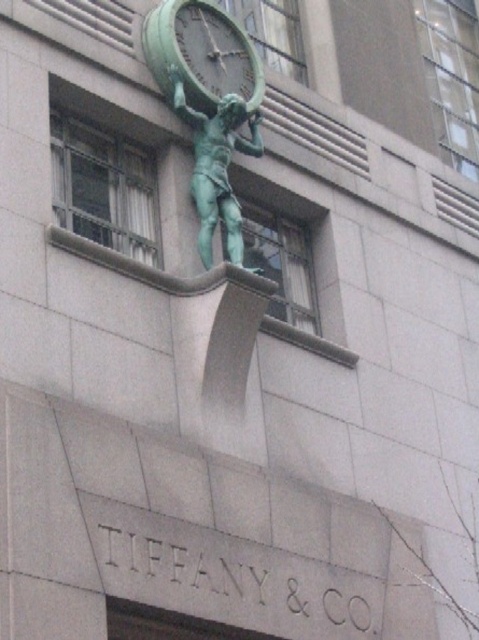
You are standing in front of the building and looking at the statue. There are two points marked on the statue. The first point is at coordinates point (x=216, y=36) and the second point is at point (x=234, y=108). Which point appears closer to your eyes?

Point (x=216, y=36) is further to the camera than point (x=234, y=108). Therefore, point (x=234, y=108) appears closer to your eyes.

You are an architect assessing the building facade. You need to determine which object, the green patina clock at upper center or the green patina statue at center, has a larger physical size based on their positions. Which one is bigger?

The green patina clock at upper center is bigger than the green patina statue at center according to the description.

You are an architect examining the building facade. You notice the green patina clock at upper center and the green patina statue at center. Which object is located to the left of the other?

The green patina clock at upper center is positioned on the left side of green patina statue at center.